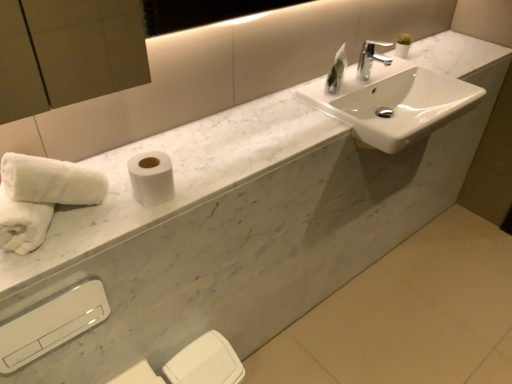
Identify the location of vacant region to the right of white matte toilet paper at center, which appears as the 2th toilet paper when viewed from the back. Image resolution: width=512 pixels, height=384 pixels. (203, 181).